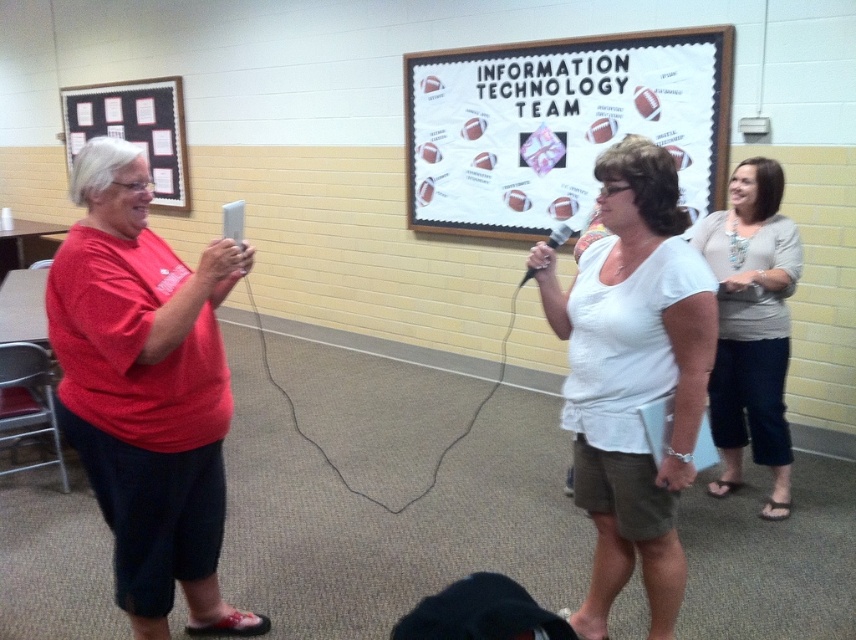
You are organizing a presentation and need to place a laptop between the white paperboard at center and the black plastic microphone at center. The laptop requires 30 inches of space. Is there enough space between them?

The distance between the white paperboard at center and the black plastic microphone at center is 29.35 inches, which is less than the required 30 inches. Therefore, there is not enough space to place the laptop between them.

You are a photographer trying to capture both the gray fabric shirt at right and the cardboard paper at upper left in a single photo. Considering their sizes, which object should you focus on to ensure both are visible in the frame?

The gray fabric shirt at right is much taller than the cardboard paper at upper left, so you should focus on the gray fabric shirt at right to ensure both are visible in the frame.